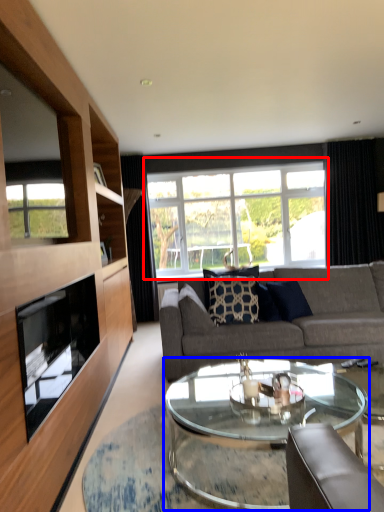
Question: Among these objects, which one is farthest to the camera, window (highlighted by a red box) or coffee table (highlighted by a blue box)?

Choices:
 (A) window
 (B) coffee table

Answer: (A)